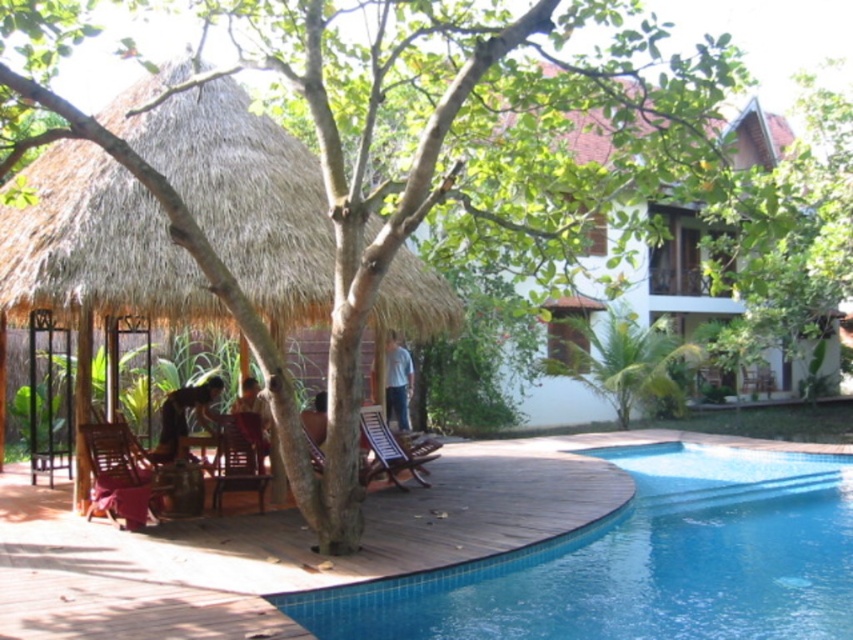
You are standing on the wooden deck and want to walk to the green leafy tree at center. Which direction should you move relative to the blue glossy pool at lower center?

You should move to the right of the blue glossy pool at lower center to reach the green leafy tree at center since the pool is positioned to the left of the tree.

You are planning to install a new umbrella on the deck near the blue glossy pool at lower center and the green leafy tree at center. Based on their positions, which object should the umbrella be placed closer to to avoid blocking the sunlight for the pool area?

The umbrella should be placed closer to the green leafy tree at center because the blue glossy pool at lower center is positioned under it, so placing the umbrella near the tree would provide shade without obstructing sunlight to the pool area.